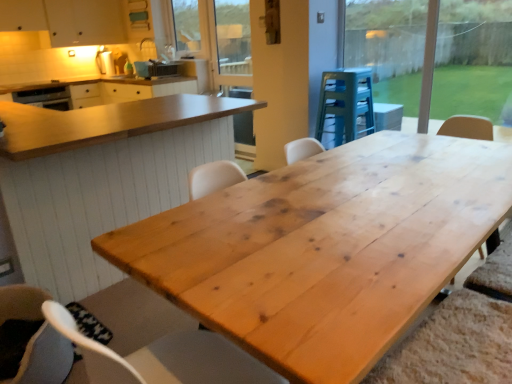
Question: Considering the relative positions of transparent glass window at upper right and wooden screen door at upper center in the image provided, is transparent glass window at upper right to the right of wooden screen door at upper center from the viewer's perspective?

Choices:
 (A) yes
 (B) no

Answer: (A)

Question: Does transparent glass window at upper right have a greater width compared to wooden screen door at upper center?

Choices:
 (A) yes
 (B) no

Answer: (A)

Question: Is transparent glass window at upper right facing towards wooden screen door at upper center?

Choices:
 (A) no
 (B) yes

Answer: (A)

Question: Does transparent glass window at upper right touch wooden screen door at upper center?

Choices:
 (A) yes
 (B) no

Answer: (B)

Question: Does transparent glass window at upper right have a larger size compared to wooden screen door at upper center?

Choices:
 (A) yes
 (B) no

Answer: (A)

Question: From their relative heights in the image, would you say natural wood table at center, marked as the 1th table in a back-to-front arrangement, is taller or shorter than transparent glass window at upper right?

Choices:
 (A) tall
 (B) short

Answer: (B)

Question: From a real-world perspective, is natural wood table at center, which is the second table from front to back, positioned above or below transparent glass window at upper right?

Choices:
 (A) below
 (B) above

Answer: (A)

Question: Is natural wood table at center, which is the second table from front to back, bigger or smaller than transparent glass window at upper right?

Choices:
 (A) small
 (B) big

Answer: (B)

Question: Is natural wood table at center, marked as the 1th table in a back-to-front arrangement, in front of or behind transparent glass window at upper right in the image?

Choices:
 (A) front
 (B) behind

Answer: (A)

Question: From the image's perspective, is wooden stool at center, which is the 1th appliance from right to left, above or below matte black toaster at upper center, arranged as the 2th appliance when viewed from the right?

Choices:
 (A) above
 (B) below

Answer: (B)

Question: From a real-world perspective, is wooden stool at center, which is the 1th appliance from right to left, above or below matte black toaster at upper center, arranged as the 2th appliance when viewed from the right?

Choices:
 (A) below
 (B) above

Answer: (A)

Question: Relative to matte black toaster at upper center, acting as the first appliance starting from the left, is wooden stool at center, the second appliance positioned from the top, in front or behind?

Choices:
 (A) behind
 (B) front

Answer: (B)

Question: Looking at their shapes, would you say wooden stool at center, which ranks as the 1th appliance in front-to-back order, is wider or thinner than matte black toaster at upper center, arranged as the 2th appliance when viewed from the right?

Choices:
 (A) wide
 (B) thin

Answer: (A)

Question: Based on their sizes in the image, would you say transparent glass window at upper right is bigger or smaller than soft gray fabric chair at lower left?

Choices:
 (A) small
 (B) big

Answer: (B)

Question: In terms of height, does transparent glass window at upper right look taller or shorter compared to soft gray fabric chair at lower left?

Choices:
 (A) short
 (B) tall

Answer: (B)